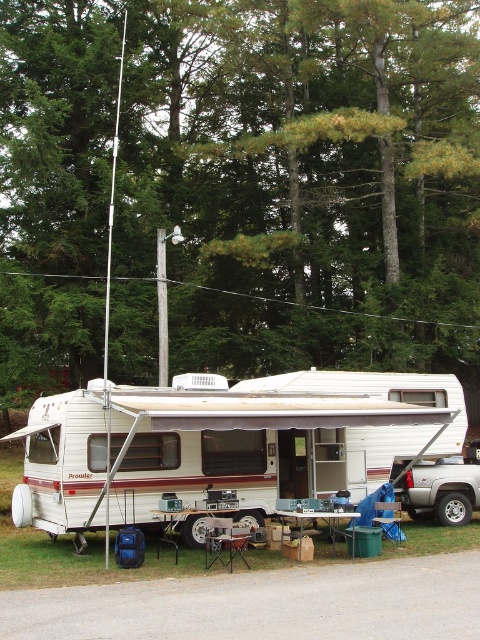
You are standing at the green leafy tree at upper center and want to take a photo of the Prowler RV parked in the wooded area. The camera you have can focus on objects up to 25 meters away. Will the camera be able to capture the Prowler RV clearly?

The green leafy tree at upper center and camera are 22.93 meters apart. Since the camera can focus up to 25 meters, it is within range, so yes, the camera can capture the Prowler RV clearly.

You are setting up a campsite and need to move the green plastic picnic table at lower center to another location. However, the white vinyl camper at center is currently blocking access to it. Can you move the camper first to gain access to the picnic table?

The white vinyl camper at center is positioned over the green plastic picnic table at lower center, so you would need to move the camper first in order to access the picnic table.

You are setting up a campsite in front of the RV and want to place a tent. You have a green leafy tree at upper center and a wooden picnic table at center. Which object is located to the left of the other?

The green leafy tree at upper center is to the left of the wooden picnic table at center.